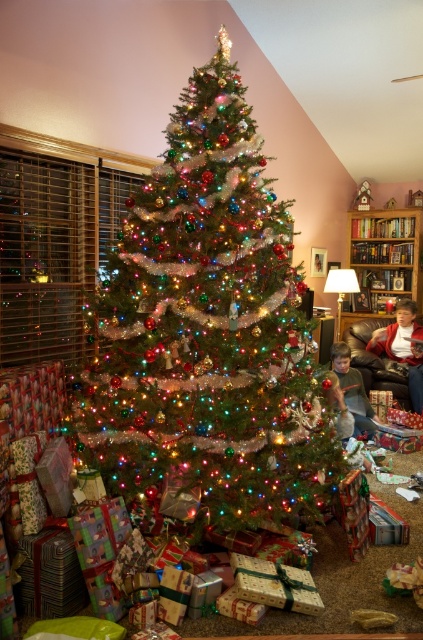
You are organizing a gift wrapping station and need to place a box between the matte red sweater at lower right and the green fabric shirt at lower center. Based on their positions, where should you place the box?

The box should be placed between the matte red sweater at lower right and the green fabric shirt at lower center, as the matte red sweater at lower right is to the right of the green fabric shirt at lower center.

You are a delivery person who just arrived with a package. You need to place it on the floor between the matte red sweater at lower right and the green fabric shirt at lower center. Can you fit the package if it measures 30 inches in length?

The distance between the matte red sweater at lower right and the green fabric shirt at lower center is 32.47 inches. Since the package is 30 inches long, it should fit comfortably within the space provided.